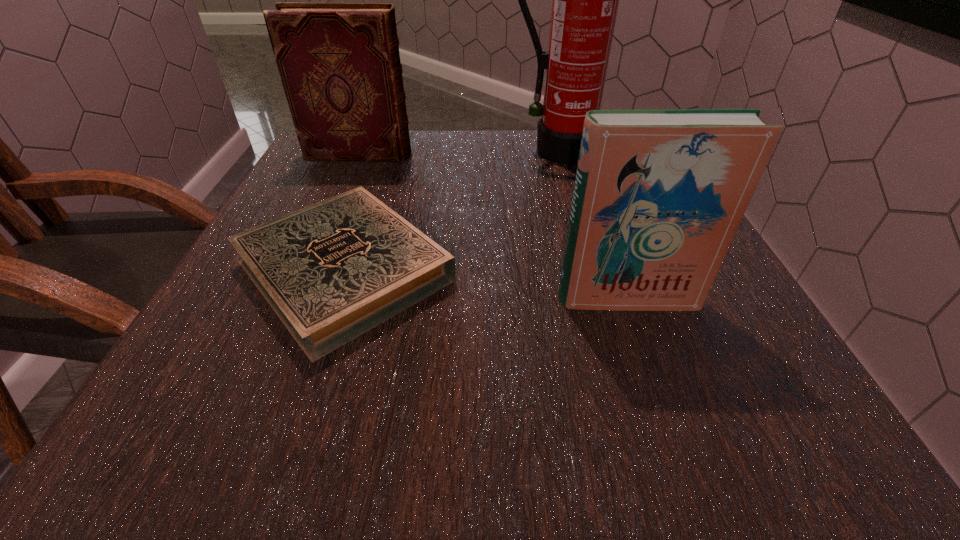
Image resolution: width=960 pixels, height=540 pixels. I want to click on fire extinguisher, so click(x=585, y=0).

This screenshot has width=960, height=540. Find the location of `the farthest hardback book`. the farthest hardback book is located at coordinates (x=339, y=63).

The width and height of the screenshot is (960, 540). In order to click on the rightmost hardback book in this screenshot , I will do `click(659, 194)`.

At what (x,y) coordinates should I click in order to perform the action: click on the shortest hardback book. Please return your answer as a coordinate pair (x, y). The image size is (960, 540). Looking at the image, I should click on (332, 271).

Image resolution: width=960 pixels, height=540 pixels. I want to click on free space located on the front-facing side of the fire extinguisher, so click(x=562, y=178).

Image resolution: width=960 pixels, height=540 pixels. Find the location of `vacant space located on the spine side of the farthest hardback book`. vacant space located on the spine side of the farthest hardback book is located at coordinates (463, 154).

Find the location of a particular element. The image size is (960, 540). free space located 0.130m on the cover of the rightmost hardback book is located at coordinates (658, 385).

Find the location of a particular element. The image size is (960, 540). vacant space located 0.080m on the right of the shortest object is located at coordinates (505, 271).

The image size is (960, 540). What are the coordinates of `fire extinguisher that is at the far edge` in the screenshot? It's located at tap(585, 0).

The width and height of the screenshot is (960, 540). What are the coordinates of `hardback book at the far edge` in the screenshot? It's located at (339, 63).